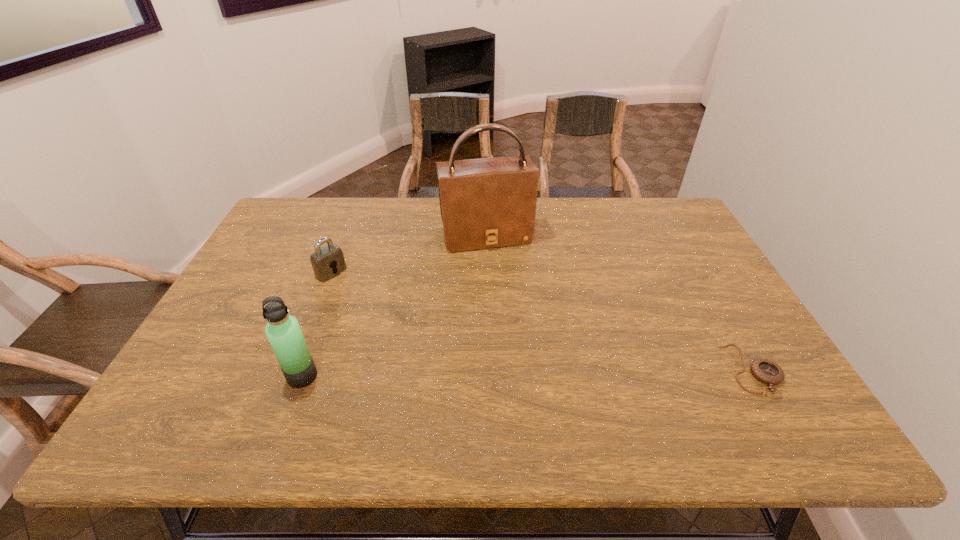
Image resolution: width=960 pixels, height=540 pixels. Identify the location of empty space between the thermos bottle and the shoulder bag. (394, 306).

Identify the location of vacant area that lies between the third tallest object and the shortest object. Image resolution: width=960 pixels, height=540 pixels. 542,321.

At what (x,y) coordinates should I click in order to perform the action: click on empty location between the tallest object and the second shortest object. Please return your answer as a coordinate pair (x, y). The width and height of the screenshot is (960, 540). Looking at the image, I should click on point(408,254).

Identify the location of free spot between the padlock and the second object from right to left. The width and height of the screenshot is (960, 540). (408, 254).

Find the location of a particular element. This screenshot has height=540, width=960. vacant space in between the second shortest object and the shortest object is located at coordinates (x=542, y=321).

At what (x,y) coordinates should I click in order to perform the action: click on unoccupied area between the rightmost object and the second shortest object. Please return your answer as a coordinate pair (x, y). This screenshot has height=540, width=960. Looking at the image, I should click on (542, 321).

You are a GUI agent. You are given a task and a screenshot of the screen. Output one action in this format:
    pyautogui.click(x=<x>, y=<y>)
    Task: Click on the object that is the second closest to the second tallest object
    The width and height of the screenshot is (960, 540).
    Given the screenshot: What is the action you would take?
    point(485,203)

Select which object appears as the second closest to the second object from right to left. Please provide its 2D coordinates. Your answer should be formatted as a tuple, i.e. [(x, y)], where the tuple contains the x and y coordinates of a point satisfying the conditions above.

[(283, 331)]

Where is `free space that satisfies the following two spatial constraints: 1. on the front side of the thermos bottle; 2. on the left side of the third nearest object`? free space that satisfies the following two spatial constraints: 1. on the front side of the thermos bottle; 2. on the left side of the third nearest object is located at coordinates (291, 376).